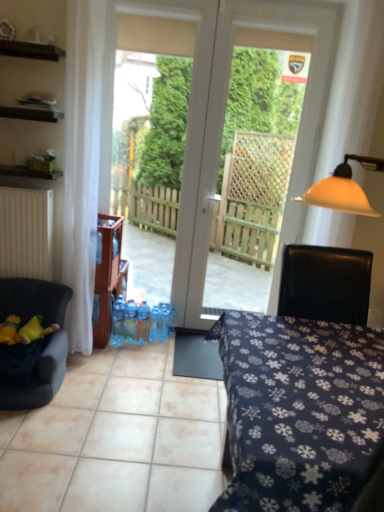
At what (x,y) coordinates should I click in order to perform the action: click on empty space that is ontop of white glossy tile at lower left (from a real-world perspective). Please return your answer as a coordinate pair (x, y). The height and width of the screenshot is (512, 384). Looking at the image, I should click on (124, 393).